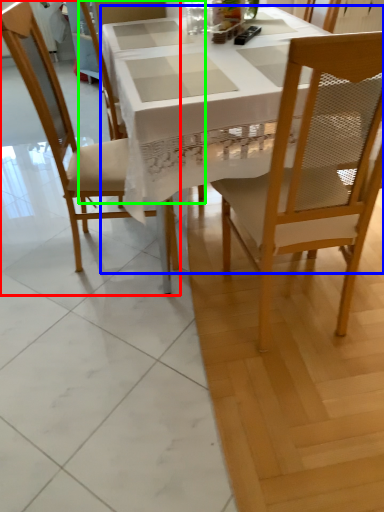
Question: Based on their relative distances, which object is farther from chair (highlighted by a red box)? Choose from desk (highlighted by a blue box) and chair (highlighted by a green box).

Choices:
 (A) desk
 (B) chair

Answer: (B)